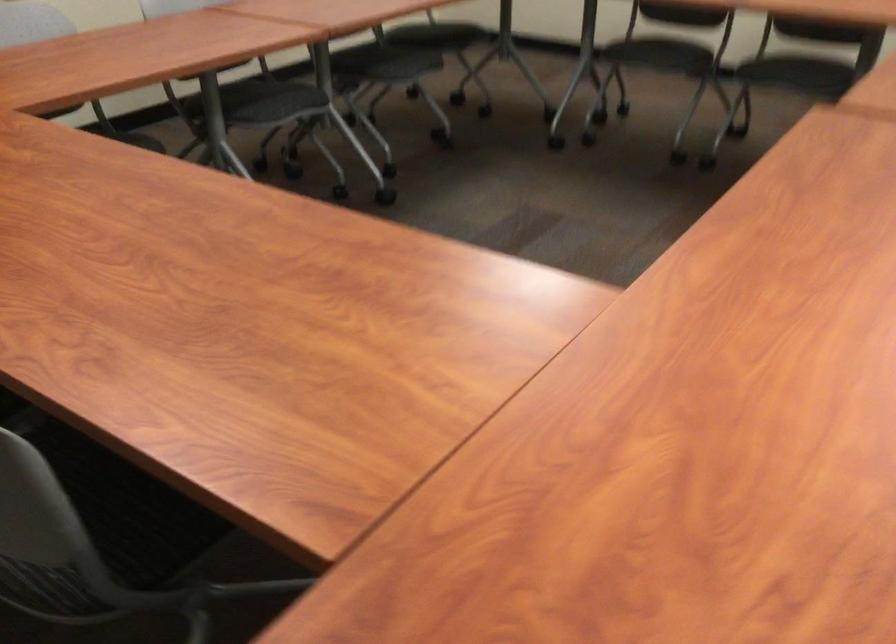
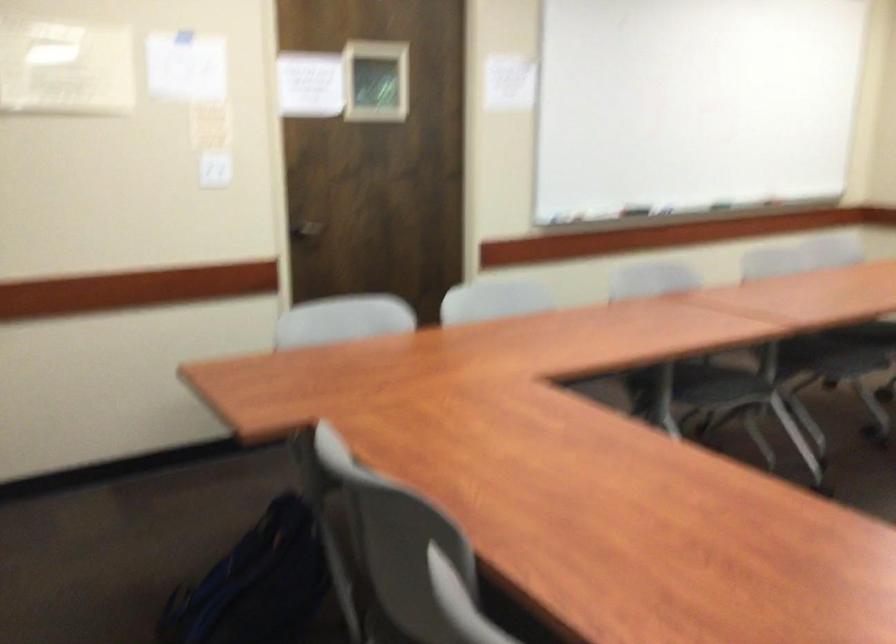
The point at (271,114) is marked in the first image. Where is the corresponding point in the second image?

(712, 386)